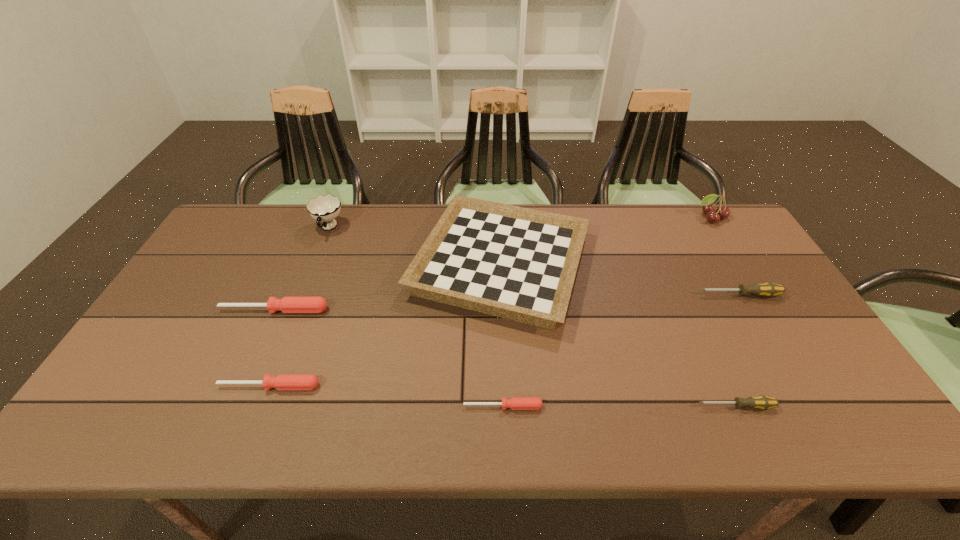
At what (x,y) coordinates should I click in order to perform the action: click on free space between the farthest red screwdriver and the cup. Please return your answer as a coordinate pair (x, y). Looking at the image, I should click on (301, 269).

Identify the location of empty space that is in between the sixth shortest object and the cherry. This screenshot has width=960, height=540. (606, 241).

What are the coordinates of `vacant point located between the third farthest screwdriver and the third tallest object` in the screenshot? It's located at (385, 325).

The image size is (960, 540). In order to click on empty location between the smaller gray screwdriver and the farthest screwdriver in this screenshot , I will do `click(737, 350)`.

Where is `the second closest object relative to the farther gray screwdriver`? The height and width of the screenshot is (540, 960). the second closest object relative to the farther gray screwdriver is located at coordinates (708, 208).

Identify which object is the closest to the cherry. Please provide its 2D coordinates. Your answer should be formatted as a tuple, i.e. [(x, y)], where the tuple contains the x and y coordinates of a point satisfying the conditions above.

[(768, 289)]

Locate which screwdriver ranks in proximity to the farthest red screwdriver. Please provide its 2D coordinates. Your answer should be formatted as a tuple, i.e. [(x, y)], where the tuple contains the x and y coordinates of a point satisfying the conditions above.

[(283, 381)]

Locate which screwdriver is the fourth closest to the checkerboard. Please provide its 2D coordinates. Your answer should be formatted as a tuple, i.e. [(x, y)], where the tuple contains the x and y coordinates of a point satisfying the conditions above.

[(762, 402)]

The height and width of the screenshot is (540, 960). What are the coordinates of `red screwdriver that can be found as the third closest to the third tallest object` in the screenshot? It's located at (283, 381).

Identify which red screwdriver is the second closest to the bigger gray screwdriver. Please provide its 2D coordinates. Your answer should be formatted as a tuple, i.e. [(x, y)], where the tuple contains the x and y coordinates of a point satisfying the conditions above.

[(283, 381)]